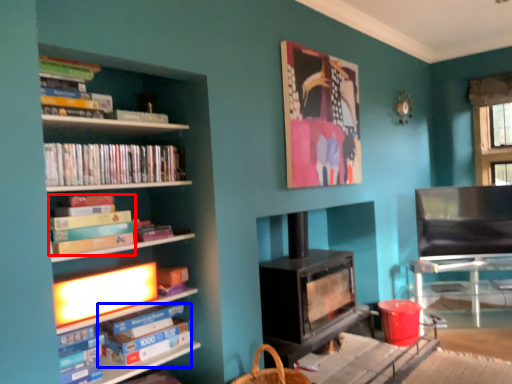
Question: Which of the following is the closest to the observer, book (highlighted by a red box) or paperback book (highlighted by a blue box)?

Choices:
 (A) book
 (B) paperback book

Answer: (A)